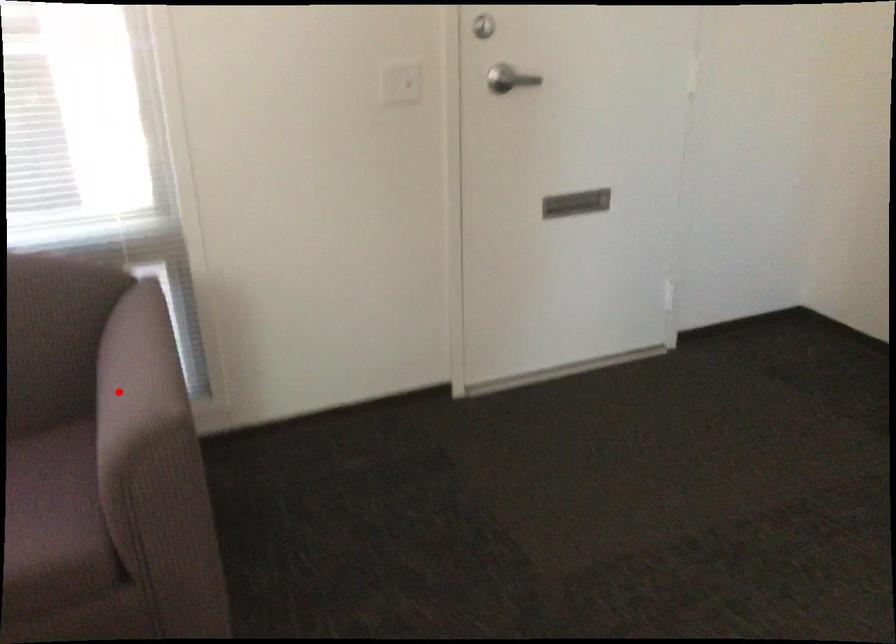
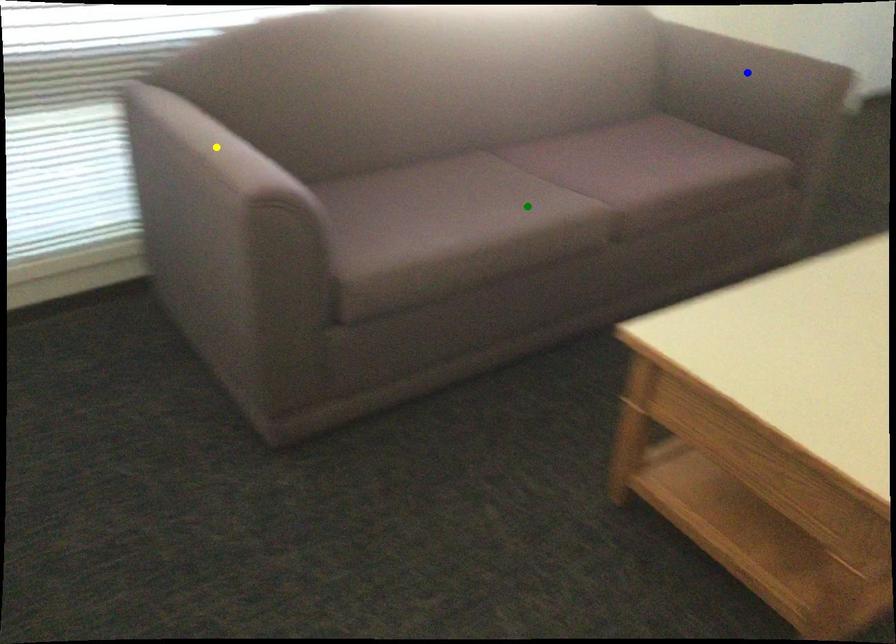
Question: I am providing you with two images of the same scene from different viewpoints. A red point is marked on the first image. You are given multiple points on the second image. Which point in image 2 represents the same 3d spot as the red point in image 1?

Choices:
 (A) green point
 (B) blue point
 (C) yellow point

Answer: (B)